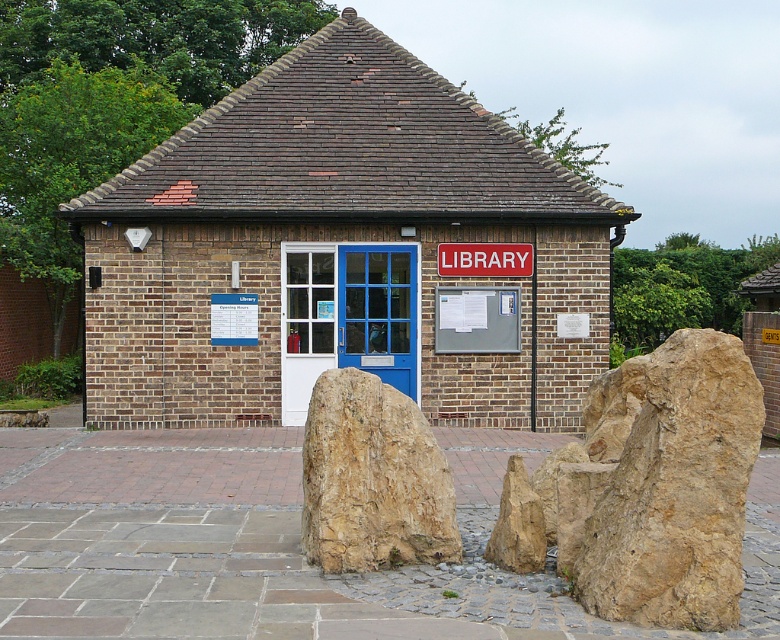
Question: Which point appears closest to the camera in this image?

Choices:
 (A) (526, 253)
 (B) (597, 593)

Answer: (B)

Question: Is brown rough rock at lower right to the left of brown rough rock at center from the viewer's perspective?

Choices:
 (A) no
 (B) yes

Answer: (A)

Question: Which point is closer to the camera taking this photo?

Choices:
 (A) (529, 257)
 (B) (383, 483)

Answer: (B)

Question: Based on their relative distances, which object is farther from the brown rough rock at lower right?

Choices:
 (A) brown rough rock at center
 (B) red plastic sign at center

Answer: (B)

Question: In this image, where is brown rough rock at lower right located relative to brown rough rock at center?

Choices:
 (A) right
 (B) left

Answer: (A)

Question: Does brown rough rock at center have a greater width compared to red plastic sign at center?

Choices:
 (A) yes
 (B) no

Answer: (B)